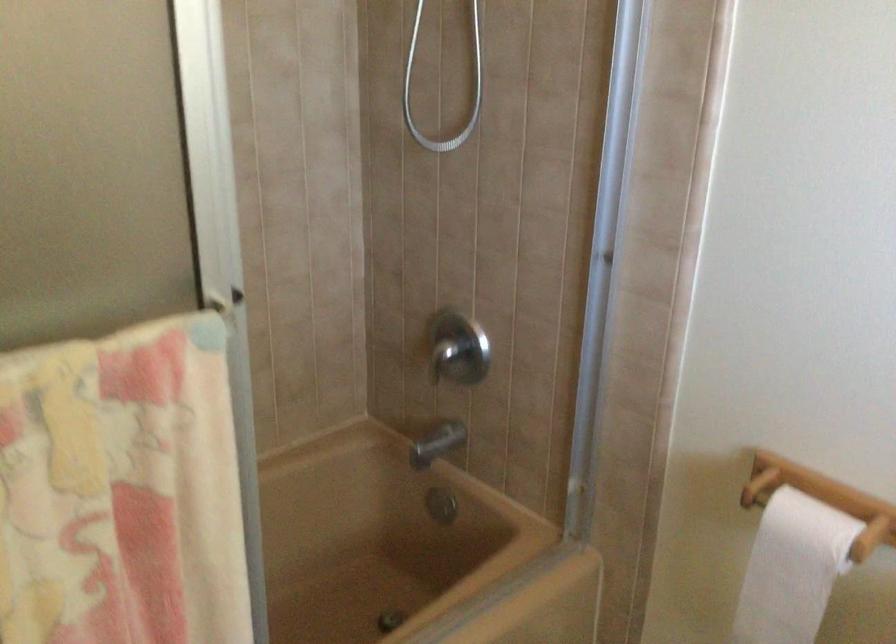
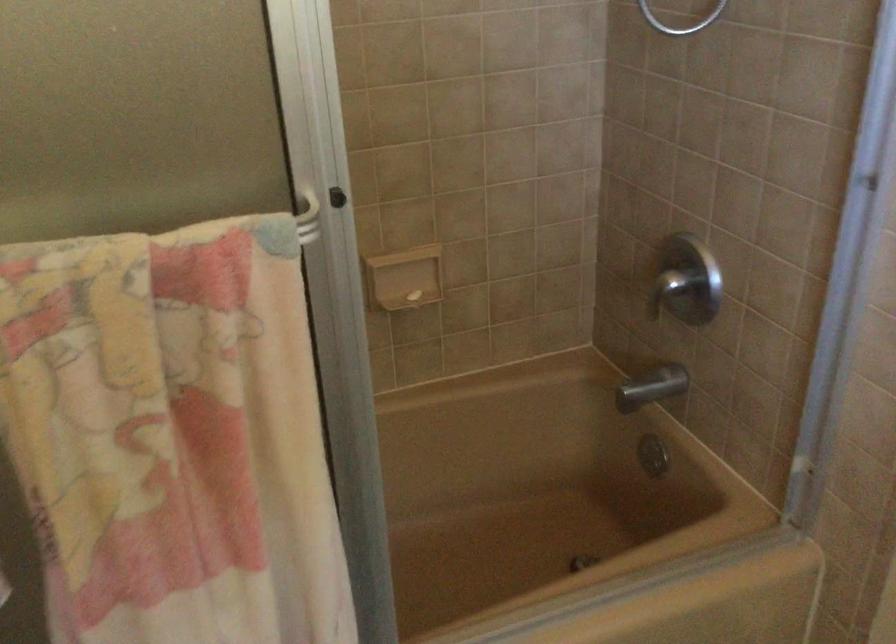
What movement of the cameraman would produce the second image?

The cameraman moved toward right, forward.